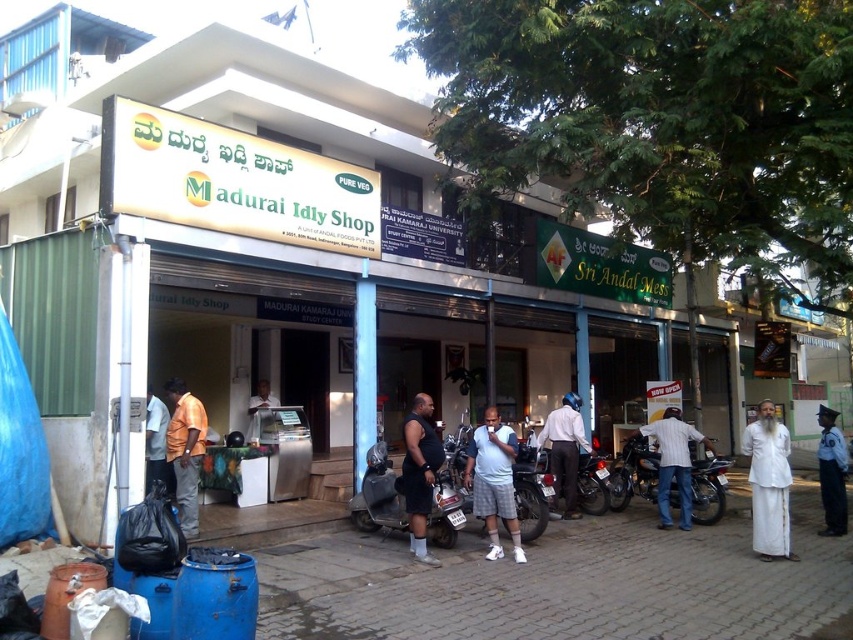
Question: Estimate the real-world distances between objects in this image. Which object is farther from the white matte building at center?

Choices:
 (A) white cotton shirt at center
 (B) orange shirt at left
 (C) metallic silver motorcycle at center
 (D) matte blue shirt at center

Answer: (B)

Question: Which point appears closest to the camera in this image?

Choices:
 (A) (364, 486)
 (B) (844, 509)
 (C) (512, 385)

Answer: (A)

Question: Estimate the real-world distances between objects in this image. Which object is closer to the white uniform at center?

Choices:
 (A) matte blue shirt at center
 (B) dark blue tank top at center
 (C) metallic silver scooter at center
 (D) metallic silver refrigerator at center

Answer: (A)

Question: Does orange cotton shirt at center appear on the left side of white uniform at center?

Choices:
 (A) yes
 (B) no

Answer: (A)

Question: From the image, what is the correct spatial relationship of white shirt at center in relation to white uniform at center?

Choices:
 (A) left
 (B) right

Answer: (A)

Question: Is white cotton shirt at center smaller than white uniform at center?

Choices:
 (A) no
 (B) yes

Answer: (B)